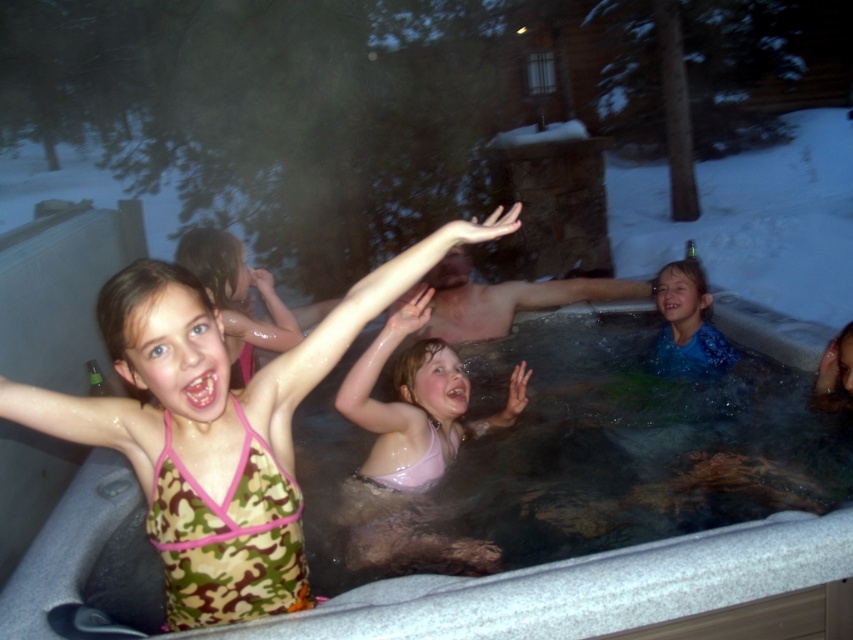
What object is located at the coordinates point (589, 588) in the image?

The white textured hot tub at center is located at point (589, 588).

Looking at this image, you are a photographer trying to capture the camouflage fabric swimsuit at upper left and the white textured hot tub at center in the same frame. Based on their positions, which object should you adjust your camera to focus on first to ensure both are in the shot?

The camouflage fabric swimsuit at upper left should be focused on first since the white textured hot tub at center is positioned to its right, so adjusting focus starting from the left ensures both are included in the frame.